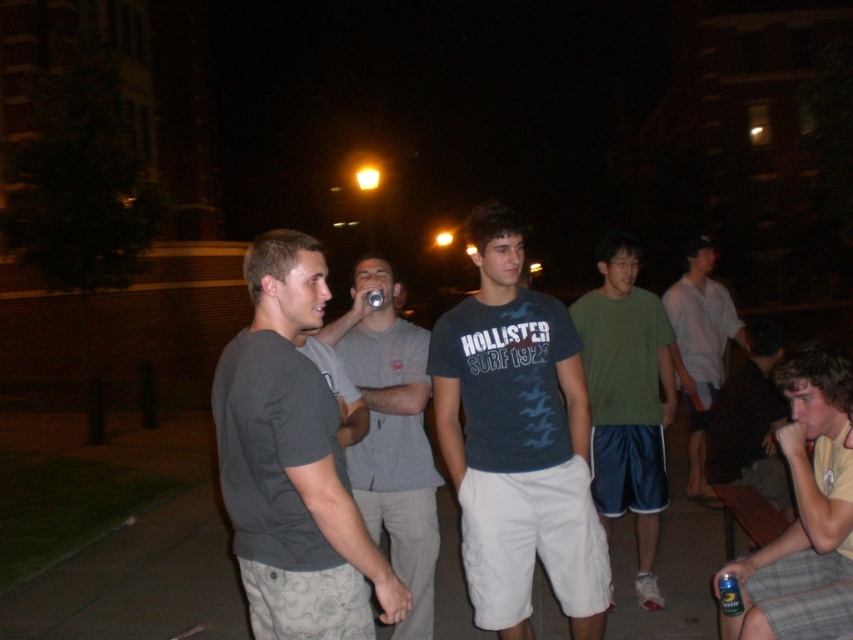
Which is more to the right, black striped shirt at lower right or white cotton shirt at right?

Positioned to the right is white cotton shirt at right.

Between point (764, 332) and point (677, 280), which one is positioned in front?

Positioned in front is point (764, 332).

At what (x,y) coordinates should I click in order to perform the action: click on black striped shirt at lower right. Please return your answer as a coordinate pair (x, y). The height and width of the screenshot is (640, 853). Looking at the image, I should click on (750, 422).

Is yellow plaid shorts at lower right smaller than black striped shirt at lower right?

Yes.

Does yellow plaid shorts at lower right appear on the right side of black striped shirt at lower right?

Incorrect, yellow plaid shorts at lower right is not on the right side of black striped shirt at lower right.

Measure the distance between point (793, 392) and camera.

A distance of 3.18 meters exists between point (793, 392) and camera.

Locate an element on the screen. The height and width of the screenshot is (640, 853). yellow plaid shorts at lower right is located at coordinates (805, 513).

Can you confirm if dark gray t-shirt at center is smaller than black striped shirt at lower right?

Yes, dark gray t-shirt at center is smaller than black striped shirt at lower right.

Is dark gray t-shirt at center thinner than black striped shirt at lower right?

No.

This screenshot has width=853, height=640. What do you see at coordinates (292, 464) in the screenshot? I see `dark gray t-shirt at center` at bounding box center [292, 464].

Image resolution: width=853 pixels, height=640 pixels. I want to click on dark gray t-shirt at center, so click(x=292, y=464).